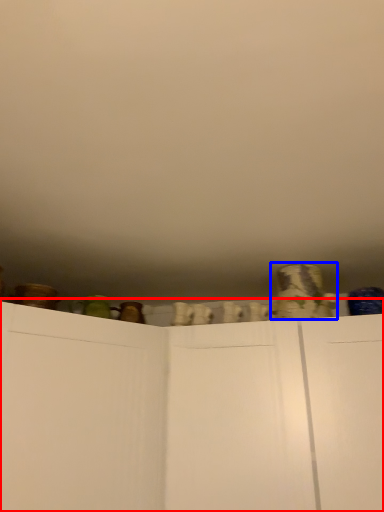
Question: Which object appears closest to the camera in this image, cupboard (highlighted by a red box) or pottery (highlighted by a blue box)?

Choices:
 (A) cupboard
 (B) pottery

Answer: (A)